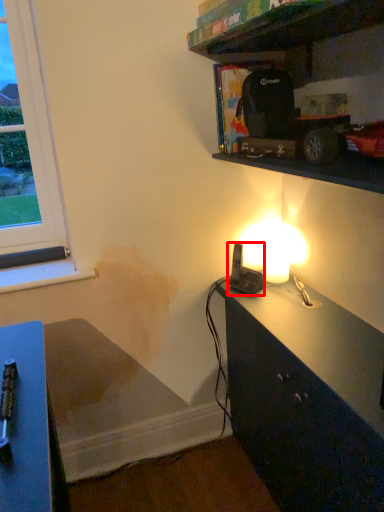
Question: Considering the relative positions of equipment (annotated by the red box) and shelf in the image provided, where is equipment (annotated by the red box) located with respect to the staircase?

Choices:
 (A) left
 (B) right

Answer: (A)